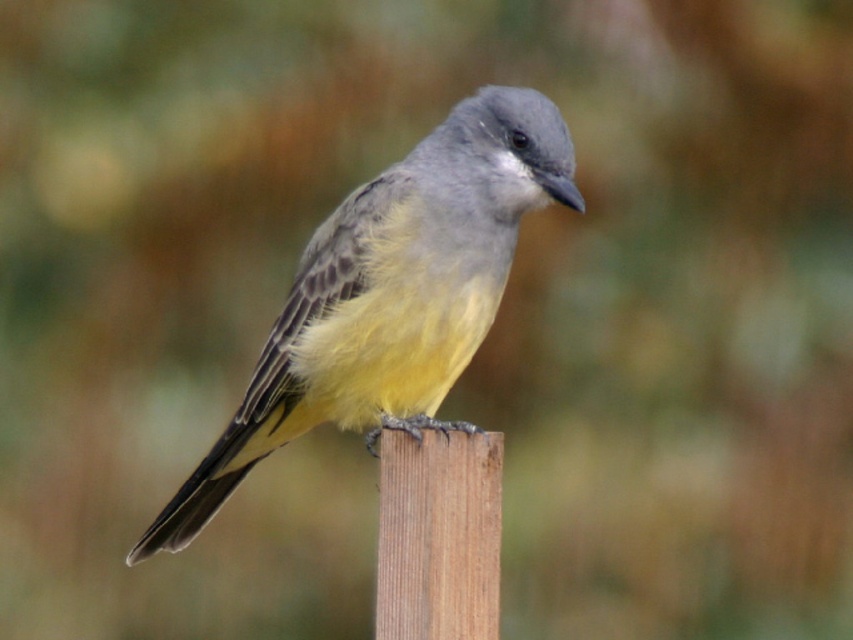
Question: Which point is closer to the camera?

Choices:
 (A) brown wood pole at center
 (B) yellow-gray feathers at center

Answer: (A)

Question: Which point appears closest to the camera in this image?

Choices:
 (A) (408, 598)
 (B) (392, 192)

Answer: (A)

Question: Does yellow-gray feathers at center have a lesser width compared to brown wood pole at center?

Choices:
 (A) no
 (B) yes

Answer: (A)

Question: Can you confirm if yellow-gray feathers at center is positioned below brown wood pole at center?

Choices:
 (A) yes
 (B) no

Answer: (B)

Question: Is yellow-gray feathers at center above brown wood pole at center?

Choices:
 (A) yes
 (B) no

Answer: (A)